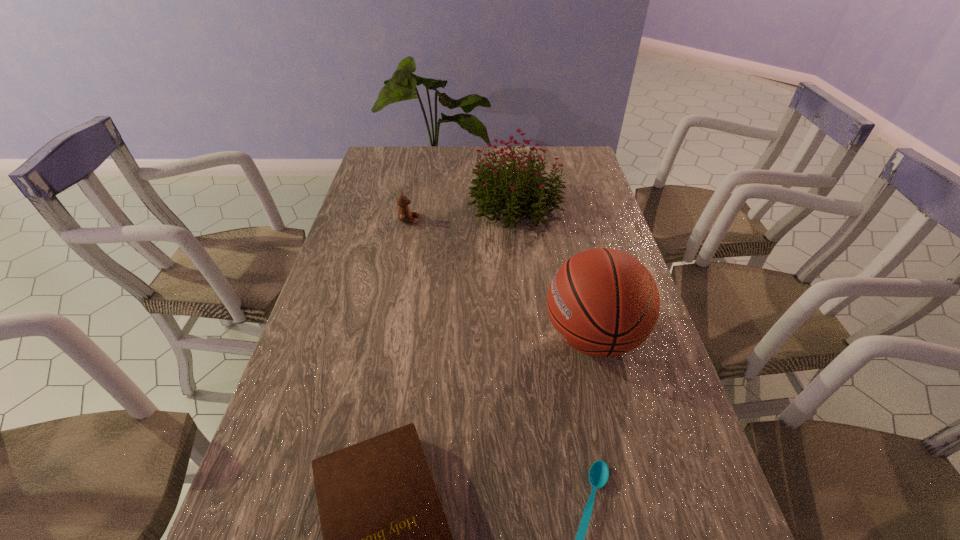
The width and height of the screenshot is (960, 540). In order to click on free region at the far edge of the desktop in this screenshot , I will do `click(431, 159)`.

The height and width of the screenshot is (540, 960). I want to click on free space at the left edge of the desktop, so click(x=306, y=374).

The width and height of the screenshot is (960, 540). In the image, there is a desktop. Find the location of `vacant space at the right edge`. vacant space at the right edge is located at coordinates (667, 402).

In the image, there is a desktop. Find the location of `vacant space at the far left corner`. vacant space at the far left corner is located at coordinates (368, 174).

Locate an element on the screen. The image size is (960, 540). free spot at the far right corner of the desktop is located at coordinates (588, 156).

The width and height of the screenshot is (960, 540). What are the coordinates of `free space between the third nearest object and the bouquet` in the screenshot? It's located at (554, 271).

The image size is (960, 540). Find the location of `vacant area that lies between the teddy bear and the bouquet`. vacant area that lies between the teddy bear and the bouquet is located at coordinates (463, 212).

Where is `free space between the bouquet and the basketball`? free space between the bouquet and the basketball is located at coordinates (554, 271).

The width and height of the screenshot is (960, 540). Identify the location of vacant space that is in between the bouquet and the third farthest object. (554, 271).

Locate which object is the second closest to the third shortest object. Please provide its 2D coordinates. Your answer should be formatted as a tuple, i.e. [(x, y)], where the tuple contains the x and y coordinates of a point satisfying the conditions above.

[(603, 302)]